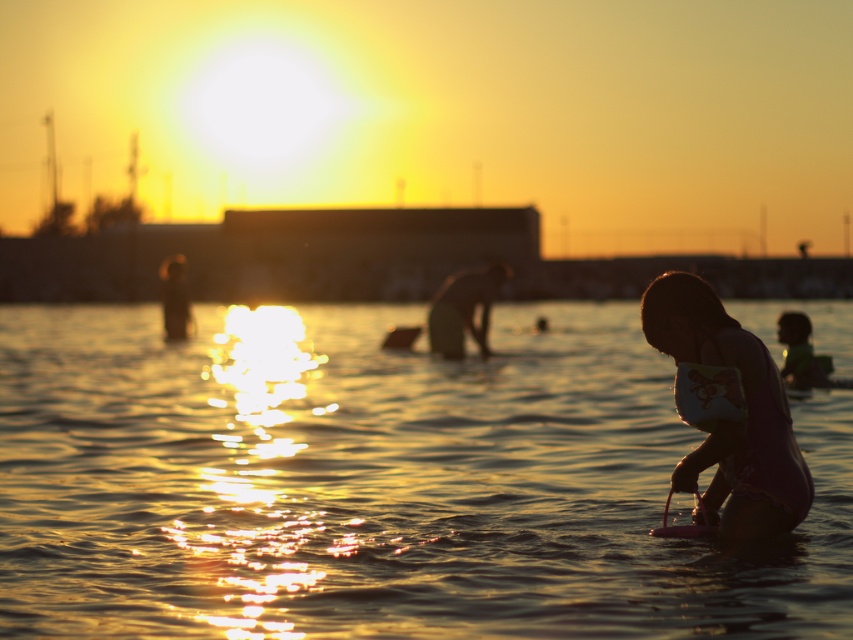
You are a lifeguard standing at the beach and you see both the smooth skin person at center and the silhouette human at left. Which one is closer to you?

The smooth skin person at center is closer to you since they are only 7.99 meters away from the silhouette human at left, but without knowing your exact position, it is hard to determine the exact distance. However, if you are positioned between them, the one closer would depend on your location.